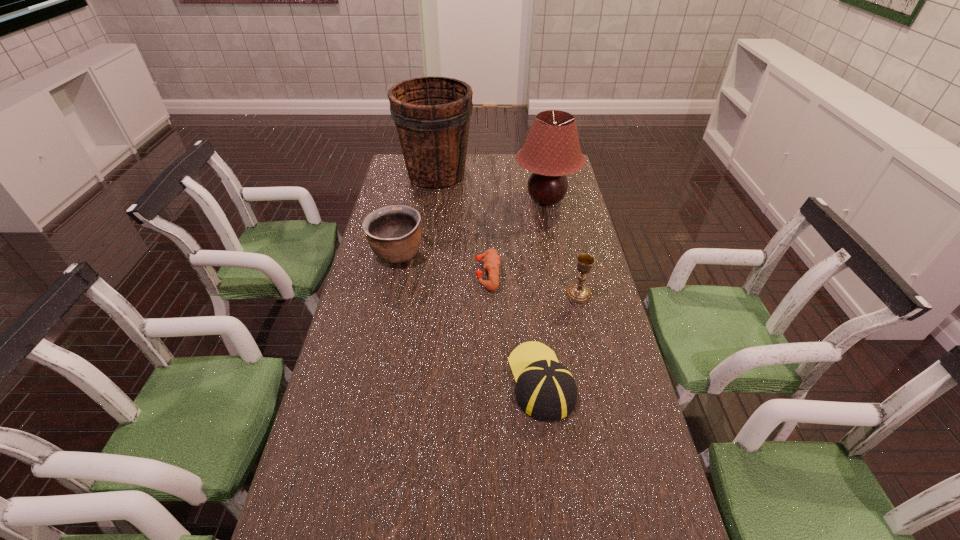
Where is `bucket`? This screenshot has width=960, height=540. bucket is located at coordinates (432, 115).

The image size is (960, 540). In order to click on lampshade in this screenshot , I will do `click(551, 151)`.

In order to click on pottery in this screenshot , I will do `click(393, 232)`.

Image resolution: width=960 pixels, height=540 pixels. In order to click on chalice in this screenshot , I will do `click(579, 293)`.

Where is `baseball cap`? The height and width of the screenshot is (540, 960). baseball cap is located at coordinates (545, 390).

You are a GUI agent. You are given a task and a screenshot of the screen. Output one action in this format:
    pyautogui.click(x=<x>, y=<y>)
    Task: Click on the second shortest object
    
    Given the screenshot: What is the action you would take?
    pyautogui.click(x=545, y=390)

Where is `the third object from left to right`? This screenshot has height=540, width=960. the third object from left to right is located at coordinates (491, 260).

Find the location of a particular element. puncher is located at coordinates (491, 260).

The height and width of the screenshot is (540, 960). Find the location of `blank space located 0.370m on the front of the bucket`. blank space located 0.370m on the front of the bucket is located at coordinates (426, 252).

Find the location of a particular element. Image resolution: width=960 pixels, height=540 pixels. free space located on the front-facing side of the lampshade is located at coordinates (561, 274).